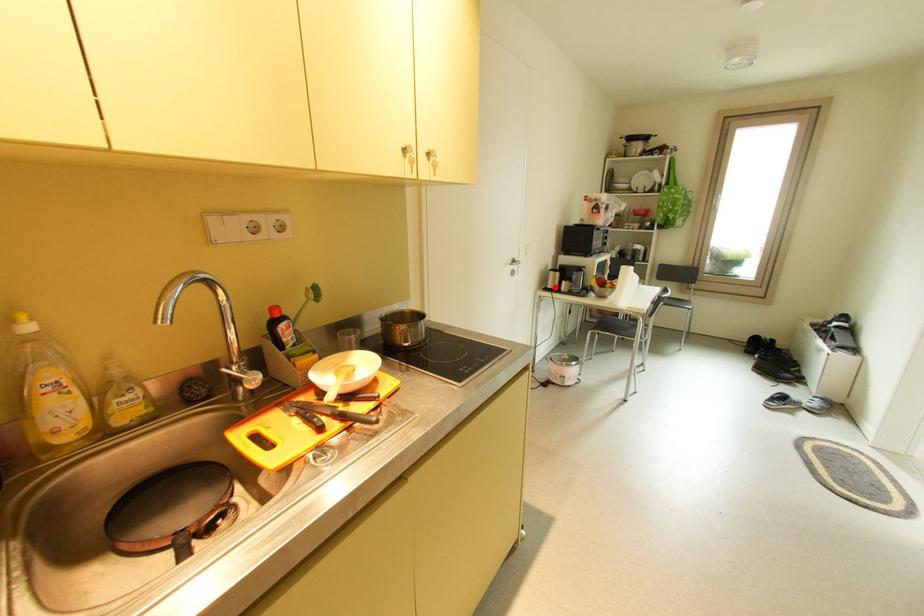
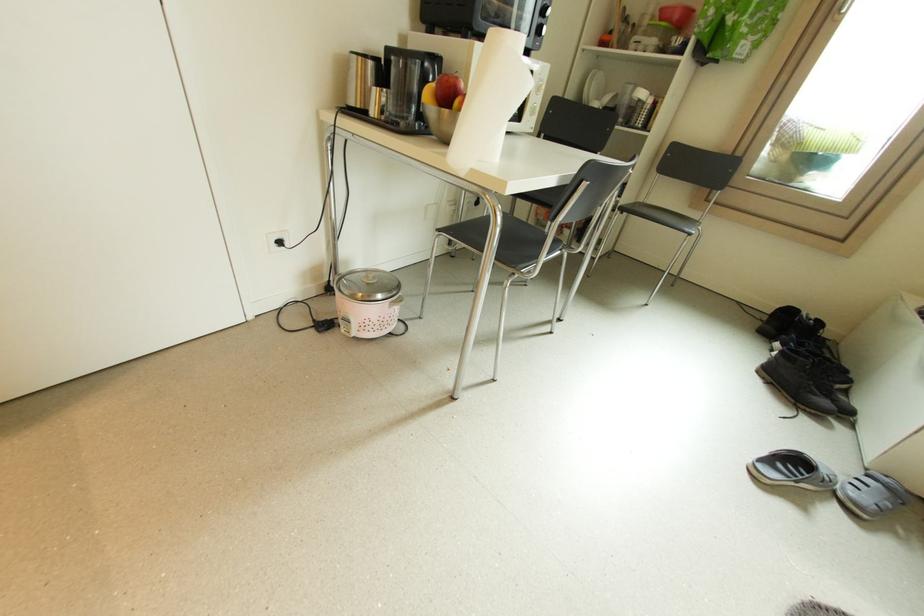
The point at the highlighted location is marked in the first image. Where is the corresponding point in the second image?

(358, 103)